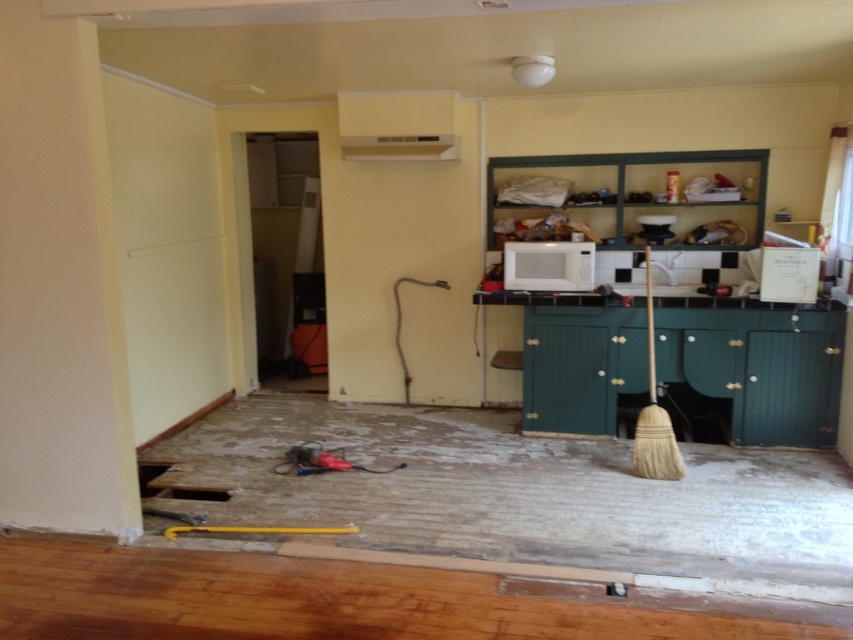
From the picture: You are a delivery person who just arrived to drop off a new microwave. The current microwave is located at the white matte microwave at center. To avoid damaging the fragile new microwave, you need to place it at least 1 meter away from the existing one. Given the kitchen layout described, is there enough space to do so?

The white matte microwave at center is located at point [548,266]. Since no other objects are mentioned in the scene that would obstruct placement beyond 1 meter from this point, there is likely sufficient space to place the new microwave safely.

You are standing in the partially renovated kitchen and want to reach both points mentioned. Which point is closer to you, point (573, 262) or point (426, 134)?

Point (573, 262) is closer to the viewer than point (426, 134).

You are standing in the partially renovated kitchen and want to reach a point that is exactly 15 feet away from you. Can you reach the point at coordinates point (538, 241)?

The point (538, 241) is 15.13 feet from viewer, so yes, you can reach the point at coordinates point (538, 241) since it is approximately 15 feet away.